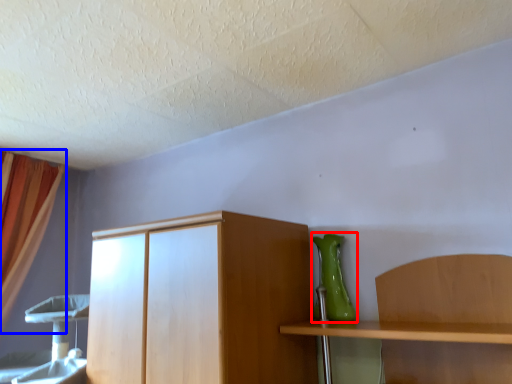
Question: Among these objects, which one is nearest to the camera, vase (highlighted by a red box) or curtain (highlighted by a blue box)?

Choices:
 (A) vase
 (B) curtain

Answer: (A)